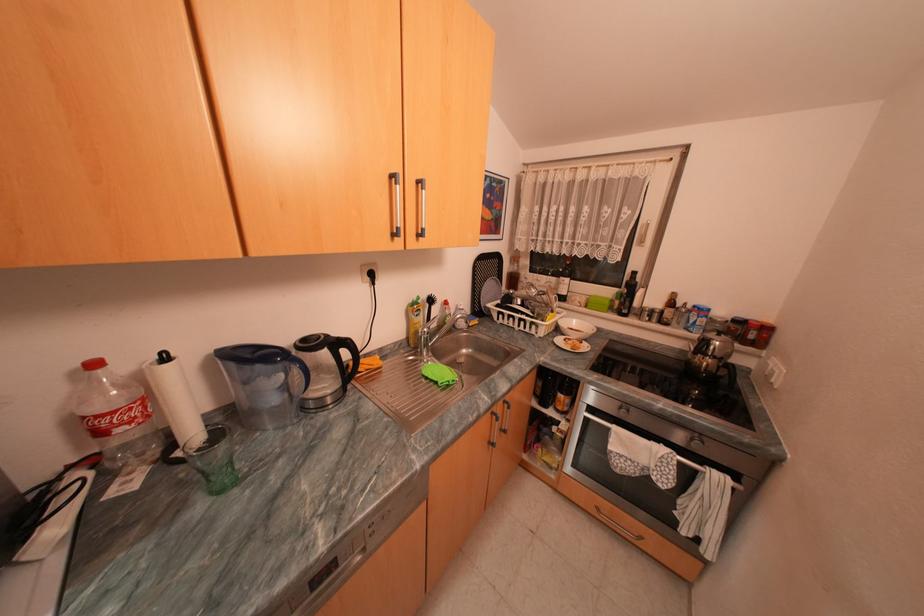
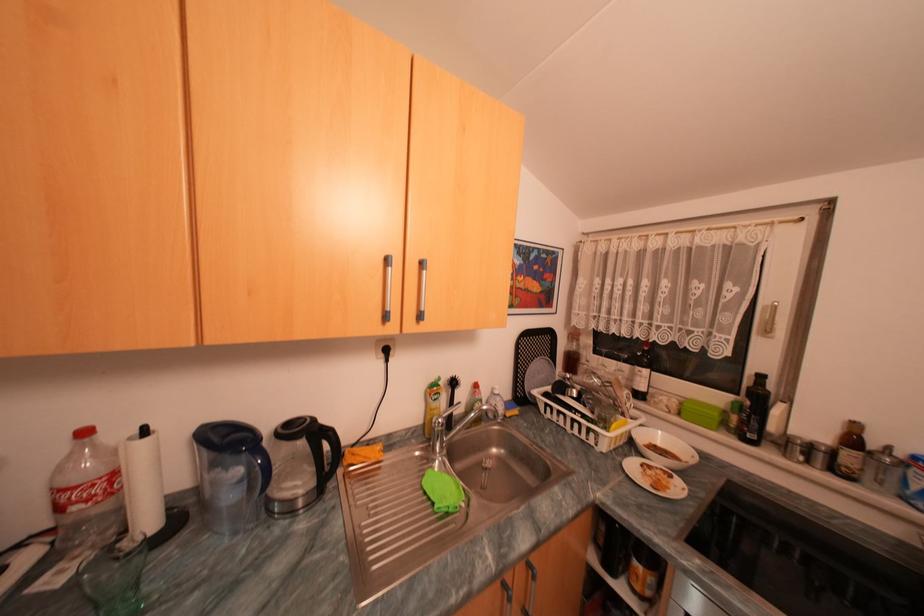
In the second image, find the point that corresponds to point 681,302 in the first image.

(862, 440)